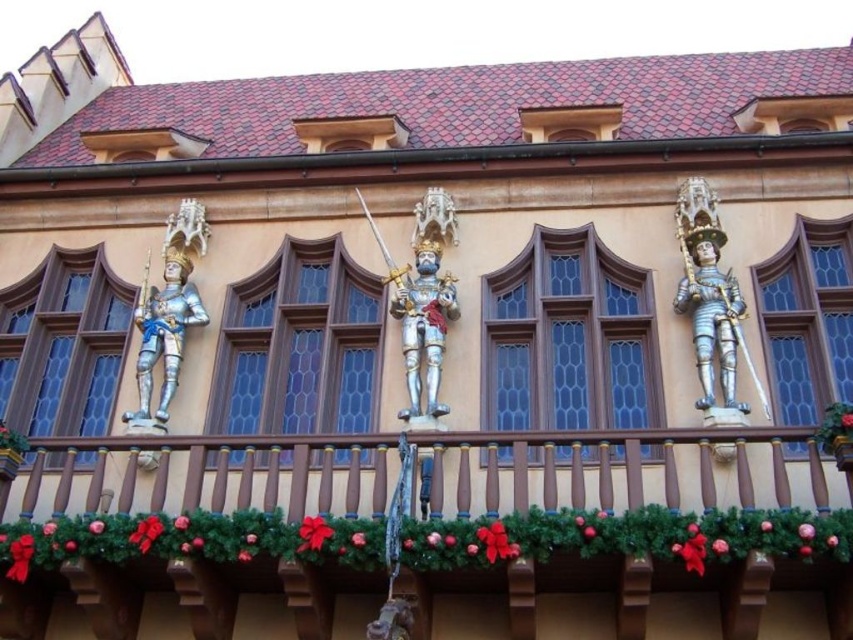
Is point (310, 516) farther from camera compared to point (485, 381)?

No, (310, 516) is in front of (485, 381).

Can you confirm if brown wooden railing at center is positioned to the left of blue glass window at center?

Indeed, brown wooden railing at center is positioned on the left side of blue glass window at center.

The image size is (853, 640). I want to click on brown wooden railing at center, so click(430, 538).

Is brown glass window at center to the right of clear glass window at center from the viewer's perspective?

In fact, brown glass window at center is to the left of clear glass window at center.

Which is behind, point (316, 381) or point (838, 360)?

Positioned behind is point (316, 381).

Is point (347, 276) more distant than point (851, 358)?

Yes, point (347, 276) is farther from viewer.

Locate an element on the screen. This screenshot has width=853, height=640. brown glass window at center is located at coordinates (299, 346).

Who is more distant from viewer, (189, 600) or (694, 337)?

Positioned behind is point (694, 337).

Who is more distant from viewer, [363,444] or [728,353]?

Point [728,353]

Identify the location of brown wooden railing at center. The width and height of the screenshot is (853, 640). (430, 538).